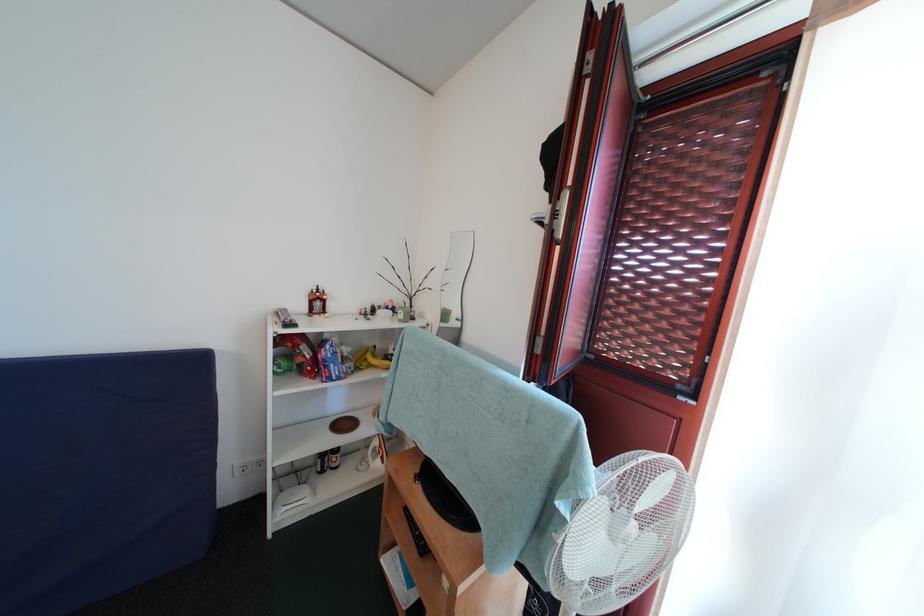
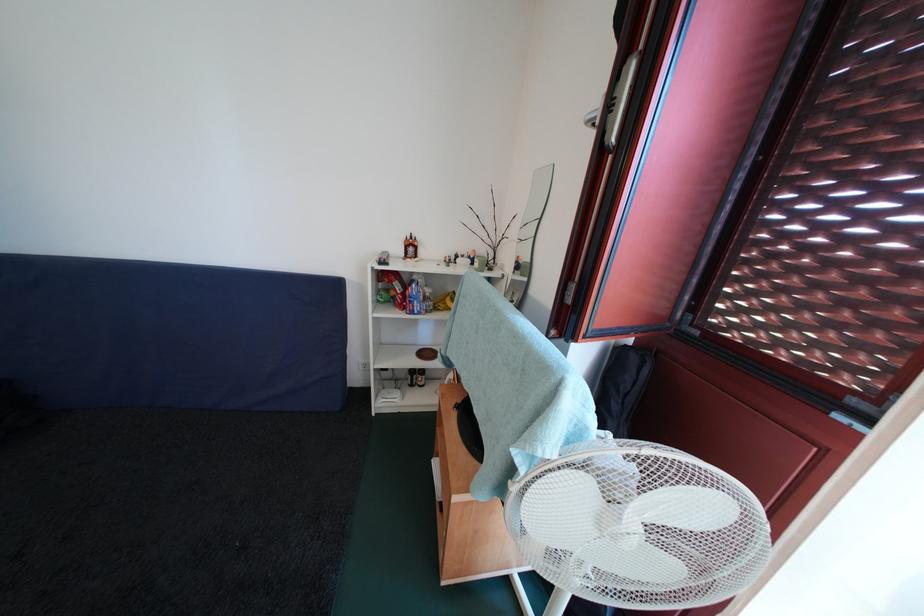
In the second image, find the point that corresponds to point 339,371 in the first image.

(422, 307)